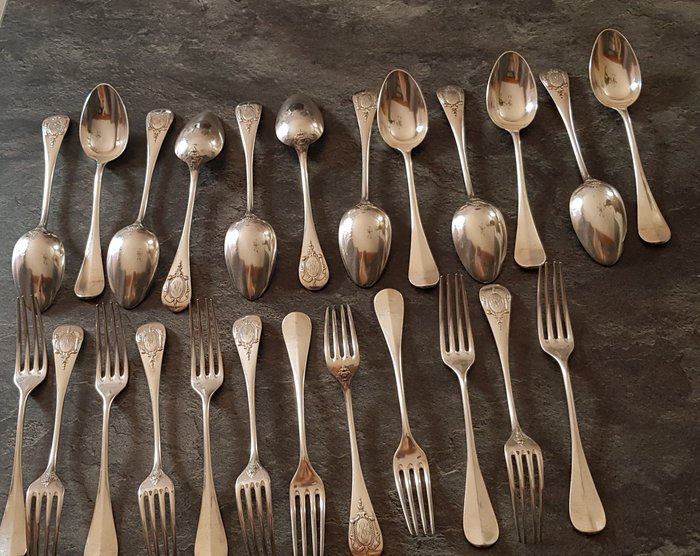
You are a GUI agent. You are given a task and a screenshot of the screen. Output one action in this format:
    pyautogui.click(x=<x>, y=<y>)
    Task: Click on the spoons pointing up
    This screenshot has height=556, width=700.
    Given the screenshot: What is the action you would take?
    pyautogui.click(x=105, y=140), pyautogui.click(x=190, y=139), pyautogui.click(x=295, y=123), pyautogui.click(x=407, y=111), pyautogui.click(x=519, y=89), pyautogui.click(x=609, y=72)